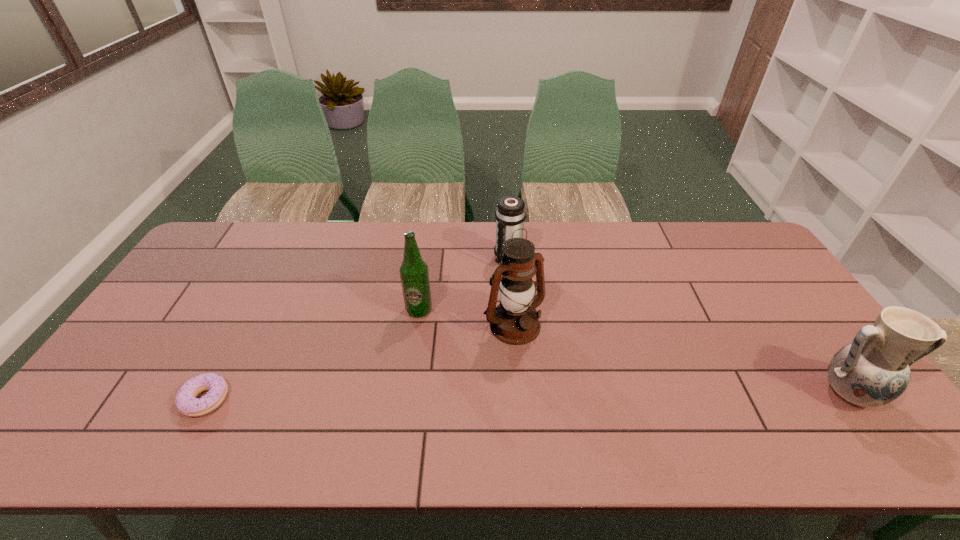
I want to click on free spot on the desktop that is between the shortest object and the rightmost object and is positioned on the side with the handle of the thermos bottle, so click(x=440, y=397).

Locate an element on the screen. The width and height of the screenshot is (960, 540). vacant space on the desktop that is between the leftmost object and the rightmost object and is positioned on the label of the fourth object from right to left is located at coordinates (476, 397).

Find the location of a particular element. The width and height of the screenshot is (960, 540). free space on the desktop that is between the doughnut and the rightmost object and is positioned on the side of the lantern, there is a wick adjustment knob is located at coordinates (568, 396).